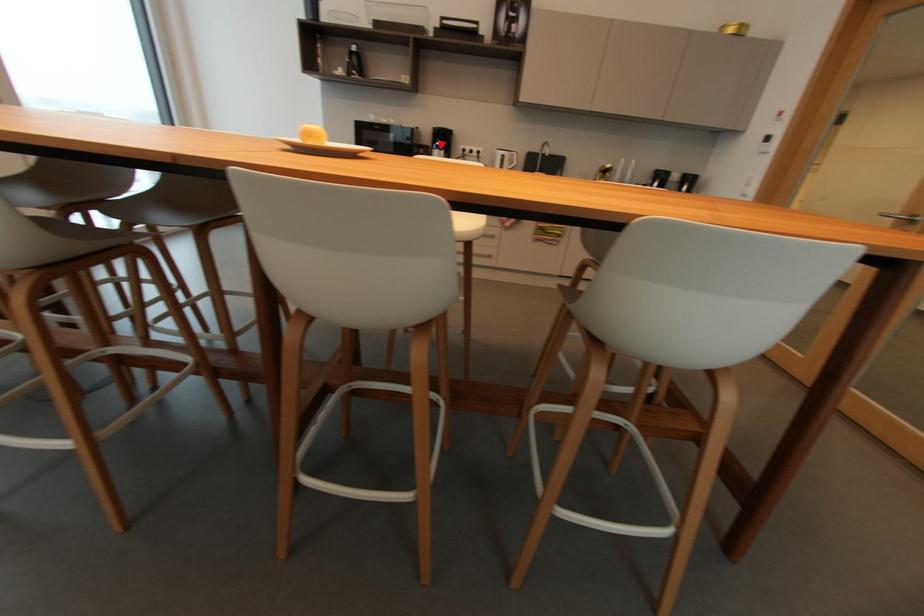
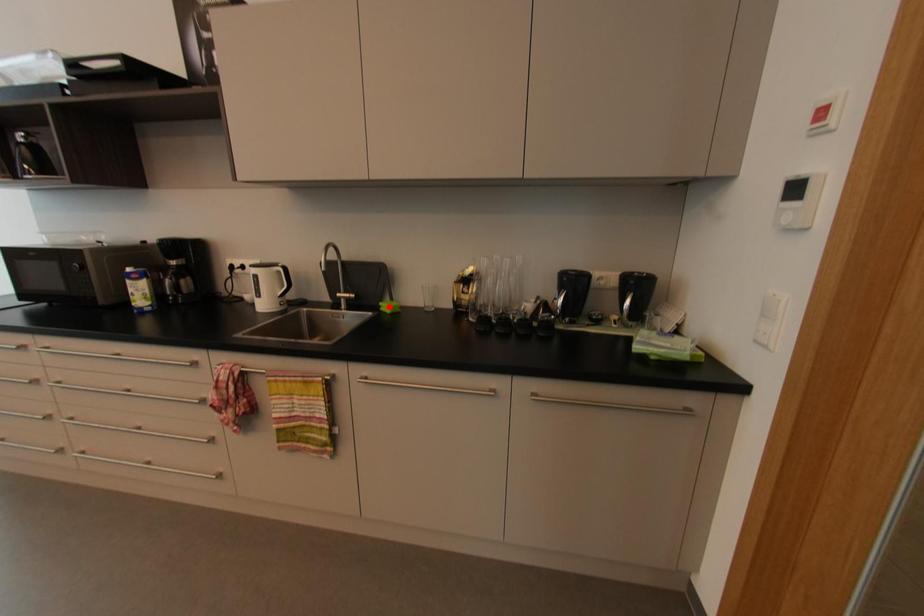
I am providing you with two images of the same scene from different viewpoints. A red point is marked on the first image and another point is marked on the second image. Is the marked point in image1 the same physical position as the marked point in image2?

No